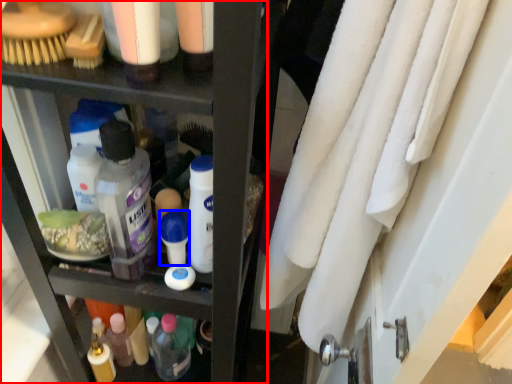
Question: Among these objects, which one is farthest to the camera, shelf (highlighted by a red box) or toiletry (highlighted by a blue box)?

Choices:
 (A) shelf
 (B) toiletry

Answer: (B)